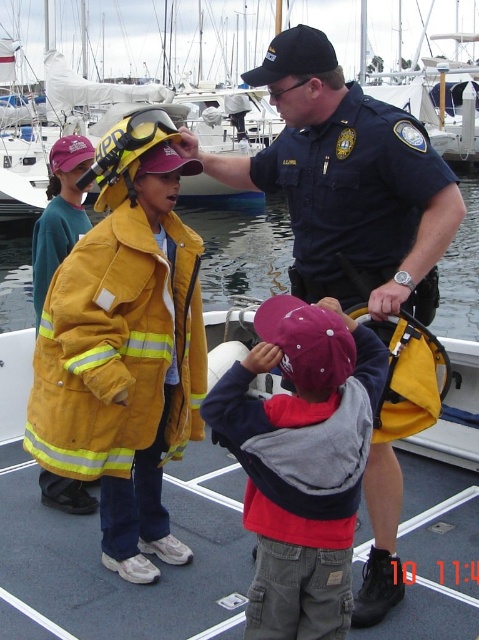
You are a photographer trying to capture a photo of the dark blue uniform at center and the maroon fabric cap at center. From the perspective of the photographer, which object is located to the right?

The dark blue uniform at center is positioned on the right side of maroon fabric cap at center, so the dark blue uniform at center is located to the right.

You are standing at the edge of the dock and want to locate the dark blue uniform at center. According to the coordinates provided, where should you look relative to the point marked as point (346, 182)?

The point (346, 182) corresponds to the dark blue uniform at center, so you should look directly at that point to locate it.